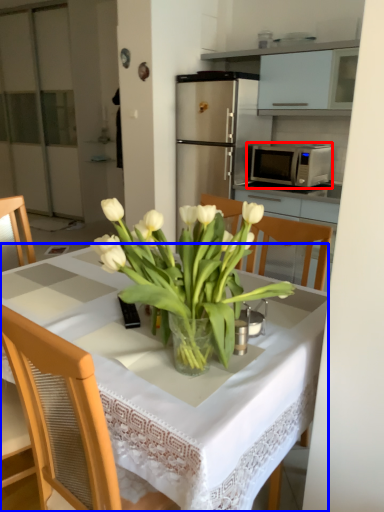
Question: Which object appears farthest to the camera in this image, microwave oven (highlighted by a red box) or desk (highlighted by a blue box)?

Choices:
 (A) microwave oven
 (B) desk

Answer: (A)